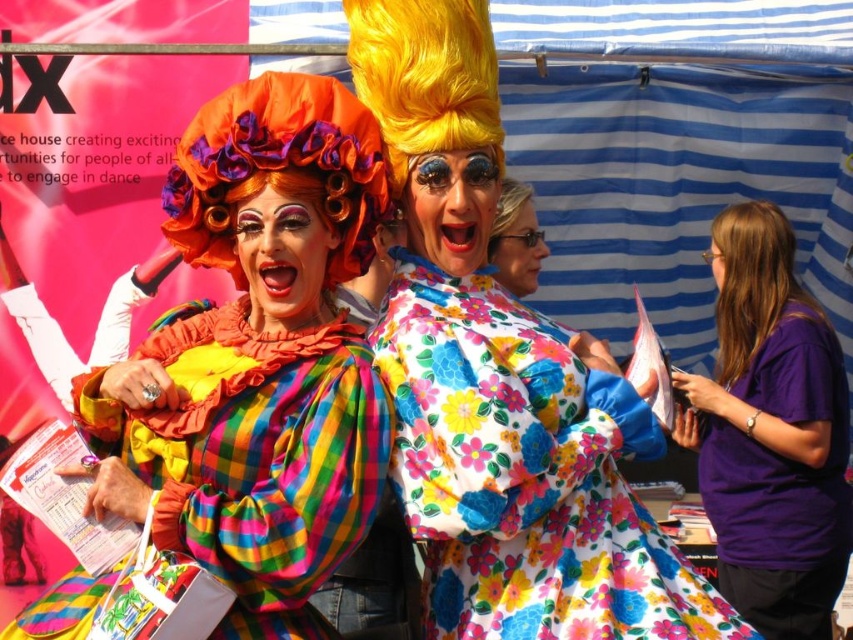
Is point (360, 429) closer to camera compared to point (512, 200)?

Yes, point (360, 429) is in front of point (512, 200).

Is multicolored plaid dress at center taller than fluffy yellow wig at center?

Indeed, multicolored plaid dress at center has a greater height compared to fluffy yellow wig at center.

Is point (172, 502) more distant than point (498, 236)?

No, it is in front of (498, 236).

Find the location of a particular element. multicolored plaid dress at center is located at coordinates (254, 458).

Can you confirm if purple cotton t-shirt at right is thinner than fluffy yellow wig at center?

Yes.

Measure the distance between point (749, 493) and camera.

The distance of point (749, 493) from camera is 20.81 meters.

Identify the location of purple cotton t-shirt at right. (770, 433).

Who is shorter, multicolored plaid dress at center or brown matte wig at right?

Standing shorter between the two is brown matte wig at right.

Is point (99, 586) farther from camera compared to point (769, 253)?

No, (99, 586) is in front of (769, 253).

Does point (260, 362) lie behind point (753, 282)?

No, (260, 362) is closer to viewer.

Locate an element on the screen. multicolored plaid dress at center is located at coordinates (254, 458).